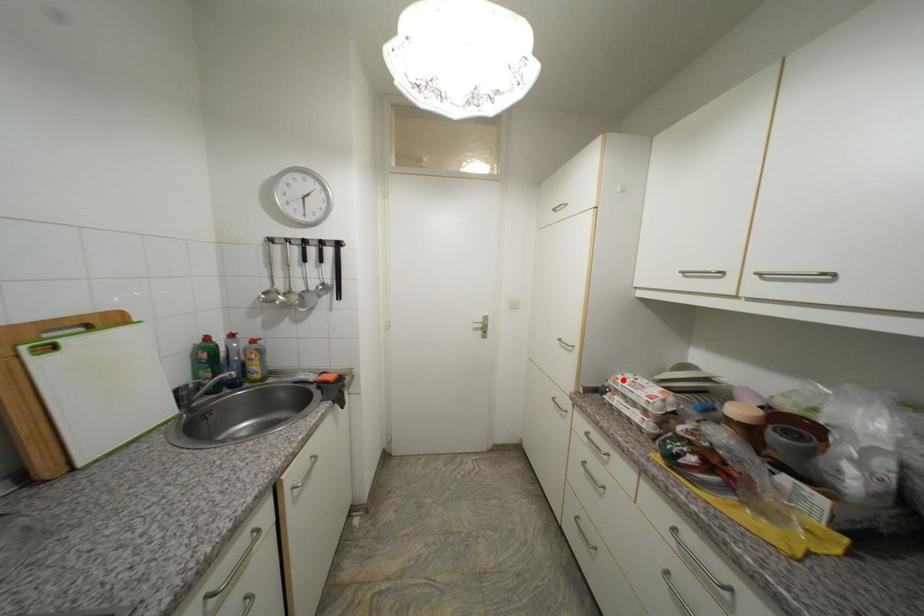
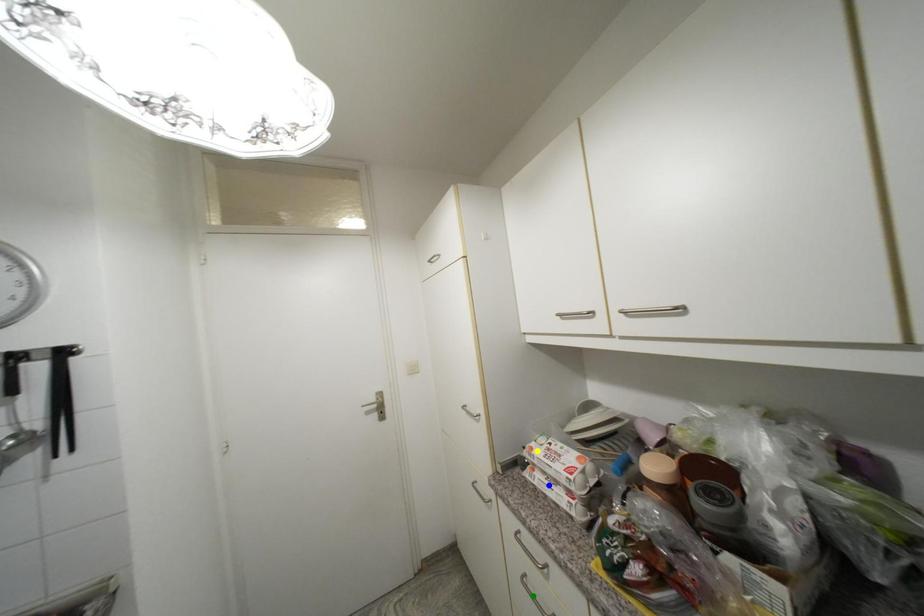
Question: I am providing you with two images of the same scene from different viewpoints. A red point is marked on the first image. You are given multiple points on the second image. Which mark in image 2 goes with the point in image 1?

Choices:
 (A) blue point
 (B) green point
 (C) yellow point

Answer: (C)